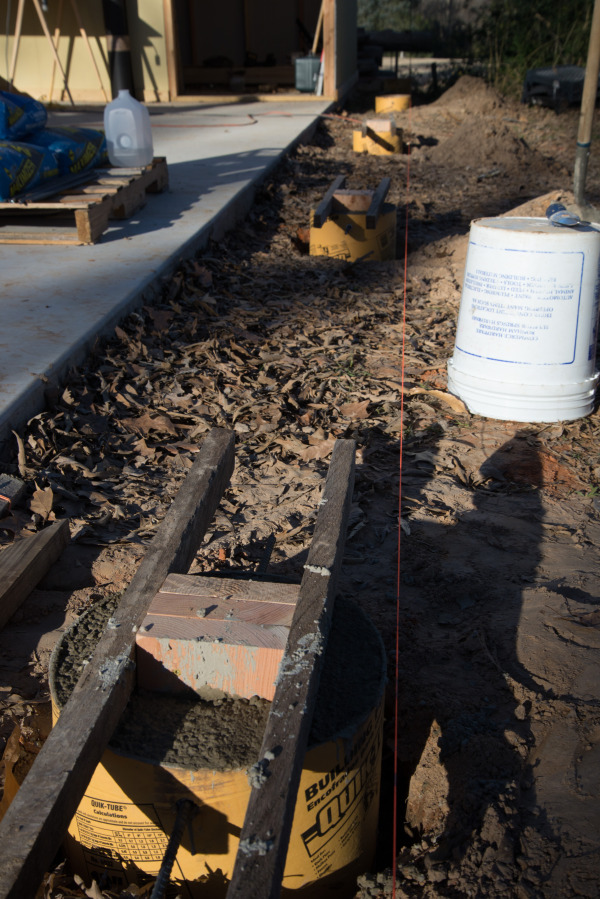
Find the location of `holder`. holder is located at coordinates (309, 73).